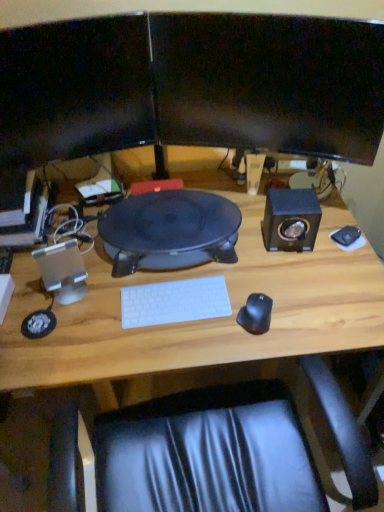
Question: Considering the relative sizes of metallic silver computer at left and silver metallic speaker at left, which appears as the 1th speaker when ordered from the bottom, in the image provided, is metallic silver computer at left bigger than silver metallic speaker at left, which appears as the 1th speaker when ordered from the bottom,?

Choices:
 (A) no
 (B) yes

Answer: (B)

Question: From the image's perspective, is metallic silver computer at left above silver metallic speaker at left, which ranks as the 1th speaker in left-to-right order?

Choices:
 (A) yes
 (B) no

Answer: (A)

Question: Is metallic silver computer at left positioned far away from silver metallic speaker at left, arranged as the 2th speaker when viewed from the top?

Choices:
 (A) no
 (B) yes

Answer: (A)

Question: Is metallic silver computer at left not inside silver metallic speaker at left, arranged as the 2th speaker when viewed from the top?

Choices:
 (A) yes
 (B) no

Answer: (A)

Question: Is the depth of metallic silver computer at left less than that of silver metallic speaker at left, which appears as the 1th speaker when ordered from the bottom?

Choices:
 (A) no
 (B) yes

Answer: (A)

Question: Is point (299, 323) closer or farther from the camera than point (339, 25)?

Choices:
 (A) closer
 (B) farther

Answer: (B)

Question: Visually, is wooden desk at center positioned to the left or to the right of black glossy monitor at upper center, the second computer monitor viewed from the left?

Choices:
 (A) left
 (B) right

Answer: (A)

Question: From a real-world perspective, relative to black glossy monitor at upper center, the second computer monitor viewed from the left, is wooden desk at center vertically above or below?

Choices:
 (A) below
 (B) above

Answer: (A)

Question: From the image's perspective, relative to black glossy monitor at upper center, the second computer monitor viewed from the left, is wooden desk at center above or below?

Choices:
 (A) below
 (B) above

Answer: (A)

Question: Visually, is matte black monitor at upper center, which appears as the first computer monitor when viewed from the left, positioned to the left or to the right of black rubberized mouse at right, the first mouse in the left-to-right sequence?

Choices:
 (A) right
 (B) left

Answer: (B)

Question: Considering the positions of matte black monitor at upper center, the second computer monitor positioned from the right, and black rubberized mouse at right, placed as the 2th mouse when sorted from right to left, in the image, is matte black monitor at upper center, the second computer monitor positioned from the right, taller or shorter than black rubberized mouse at right, placed as the 2th mouse when sorted from right to left,?

Choices:
 (A) tall
 (B) short

Answer: (A)

Question: Which is correct: matte black monitor at upper center, the second computer monitor positioned from the right, is inside black rubberized mouse at right, the 1th mouse when ordered from bottom to top, or outside of it?

Choices:
 (A) inside
 (B) outside

Answer: (B)

Question: Is matte black monitor at upper center, which appears as the first computer monitor when viewed from the left, in front of or behind black rubberized mouse at right, the second mouse when ordered from top to bottom, in the image?

Choices:
 (A) behind
 (B) front

Answer: (B)

Question: From their relative heights in the image, would you say black glossy monitor at upper center, the second computer monitor viewed from the left, is taller or shorter than silver metallic speaker at left, which is the 2th speaker from right to left?

Choices:
 (A) tall
 (B) short

Answer: (A)

Question: Is black glossy monitor at upper center, the second computer monitor viewed from the left, in front of or behind silver metallic speaker at left, which ranks as the 1th speaker in left-to-right order, in the image?

Choices:
 (A) front
 (B) behind

Answer: (A)